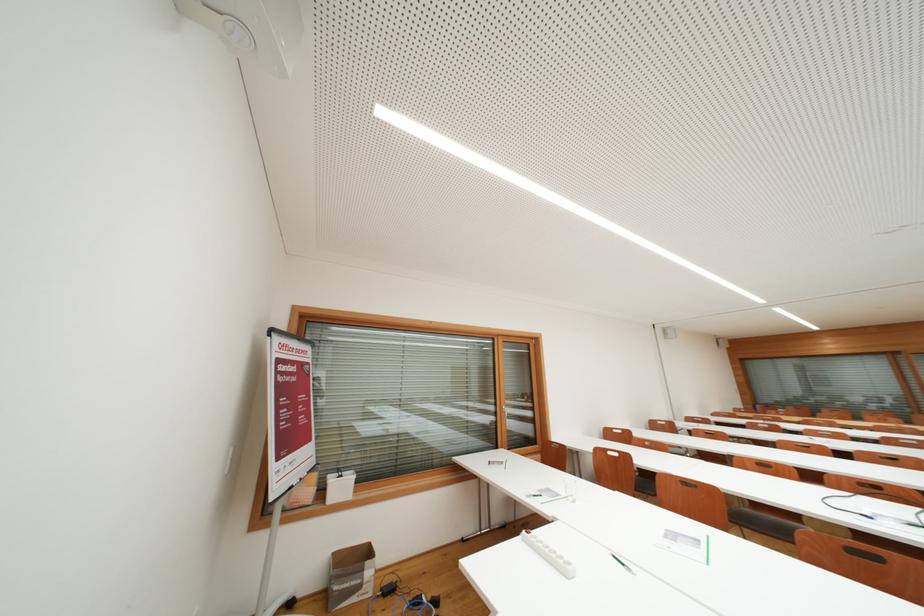
Describe the element at coordinates (252, 29) in the screenshot. This screenshot has height=616, width=924. I see `a white projector dial` at that location.